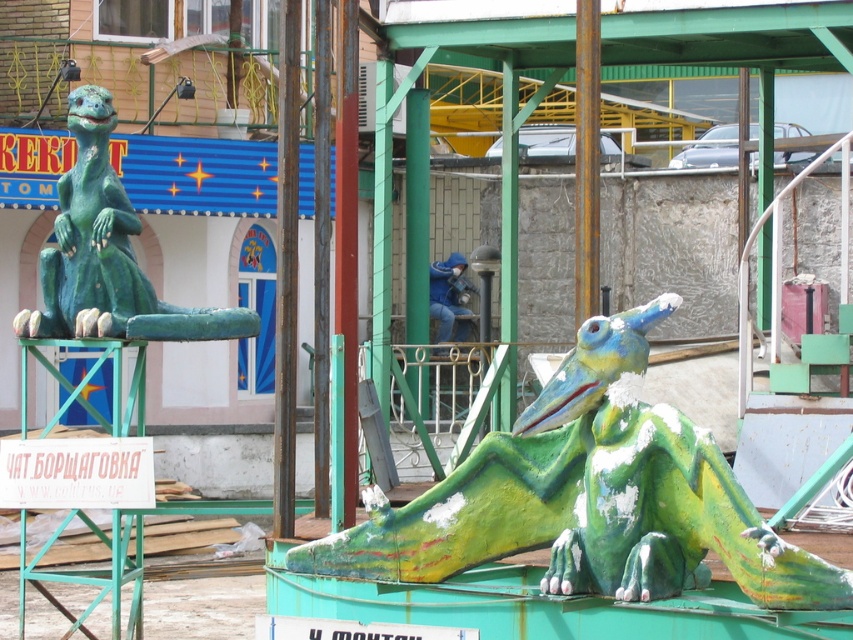
Consider the image. Can you confirm if green painted wood dragon at left is shorter than rusty metal pole at center?

Result: Correct, green painted wood dragon at left is not as tall as rusty metal pole at center.

Who is positioned more to the left, green painted wood dragon at left or rusty metal pole at center?

Positioned to the left is green painted wood dragon at left.

Is point (91, 291) closer to viewer compared to point (579, 294)?

No.

This screenshot has height=640, width=853. Find the location of `green painted wood dragon at left`. green painted wood dragon at left is located at coordinates (107, 253).

Consider the image. Is green matte dragon at center taller than rusty metal pole at center?

No, green matte dragon at center is not taller than rusty metal pole at center.

The width and height of the screenshot is (853, 640). I want to click on green matte dragon at center, so click(589, 497).

Is metallic pole at center to the right of rusty metal pole at center from the viewer's perspective?

No, metallic pole at center is not to the right of rusty metal pole at center.

This screenshot has height=640, width=853. What do you see at coordinates (286, 269) in the screenshot? I see `metallic pole at center` at bounding box center [286, 269].

Between point (283, 390) and point (579, 26), which one is positioned in front?

Point (579, 26)

At what (x,y) coordinates should I click in order to perform the action: click on metallic pole at center. Please return your answer as a coordinate pair (x, y). This screenshot has height=640, width=853. Looking at the image, I should click on (286, 269).